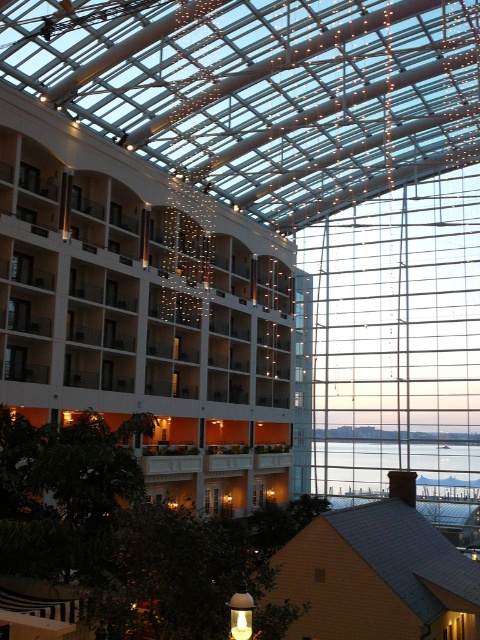
Question: Estimate the real-world distances between objects in this image. Which object is closer to the transparent glass water at center?

Choices:
 (A) yellow shingled roof at lower right
 (B) white glossy hotel at center

Answer: (B)

Question: Does white glossy hotel at center have a larger size compared to transparent glass water at center?

Choices:
 (A) no
 (B) yes

Answer: (B)

Question: Considering the real-world distances, which object is closest to the transparent glass water at center?

Choices:
 (A) white glossy hotel at center
 (B) yellow shingled roof at lower right

Answer: (A)

Question: Is white glossy hotel at center behind transparent glass water at center?

Choices:
 (A) yes
 (B) no

Answer: (B)

Question: Which point is farther from the camera taking this photo?

Choices:
 (A) (384, 620)
 (B) (86, 397)

Answer: (B)

Question: Does white glossy hotel at center have a larger size compared to yellow shingled roof at lower right?

Choices:
 (A) no
 (B) yes

Answer: (B)